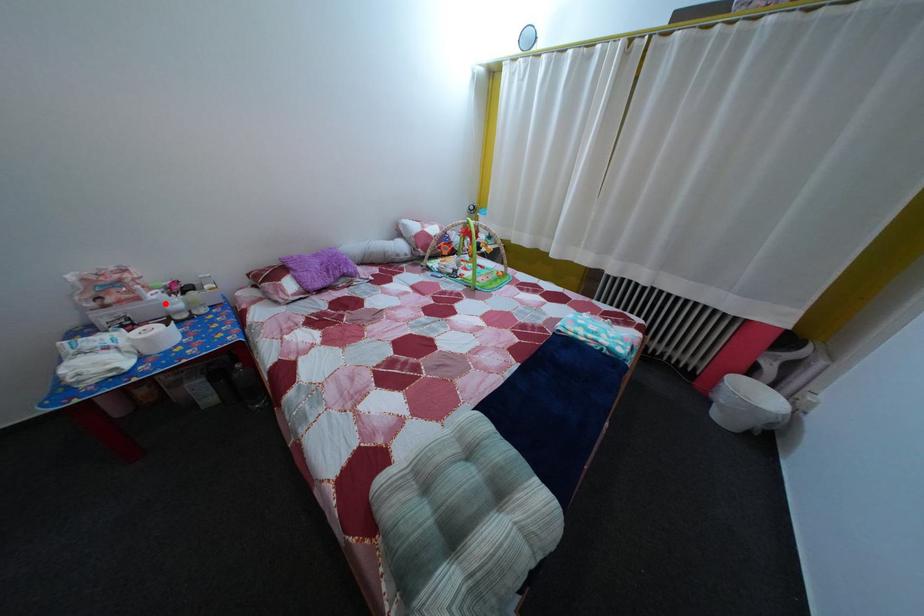
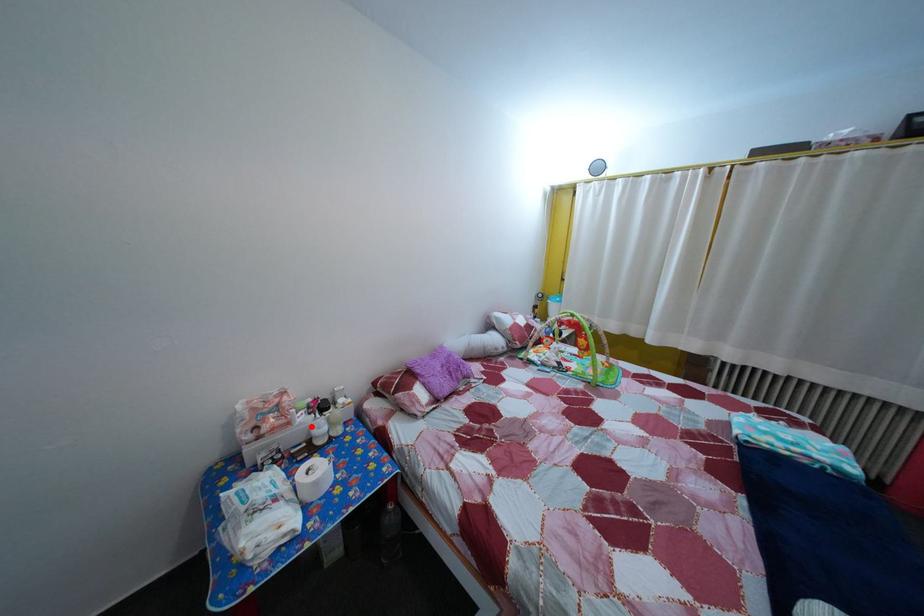
I am providing you with two images of the same scene from different viewpoints. A red point is marked on the first image and another point is marked on the second image. Is the red point in image1 aligned with the point shown in image2?

Yes